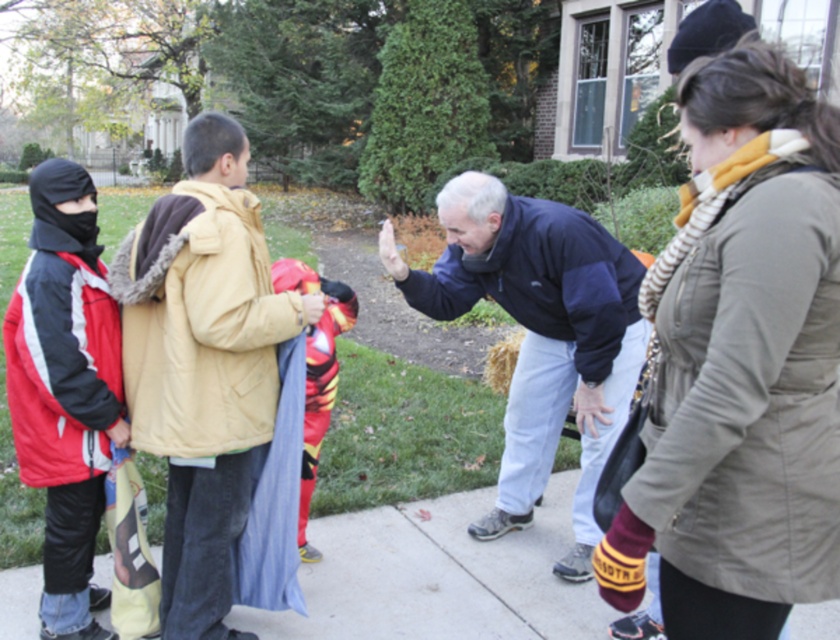
Does tan fleece jacket at center appear under smooth concrete pavement at center?

Actually, tan fleece jacket at center is above smooth concrete pavement at center.

Is point (189, 356) more distant than point (462, 564)?

No, (189, 356) is in front of (462, 564).

I want to click on tan fleece jacket at center, so click(x=203, y=365).

Which is above, tan fleece jacket at center or dark blue fleece jacket at center?

dark blue fleece jacket at center is above.

Can you confirm if tan fleece jacket at center is smaller than dark blue fleece jacket at center?

Yes.

I want to click on tan fleece jacket at center, so click(x=203, y=365).

Does striped scarf at center have a lesser width compared to tan fleece jacket at center?

Yes, striped scarf at center is thinner than tan fleece jacket at center.

Between point (770, 246) and point (187, 198), which one is positioned in front?

Point (770, 246) is more forward.

Identify the location of striped scarf at center. The width and height of the screenshot is (840, 640). (739, 364).